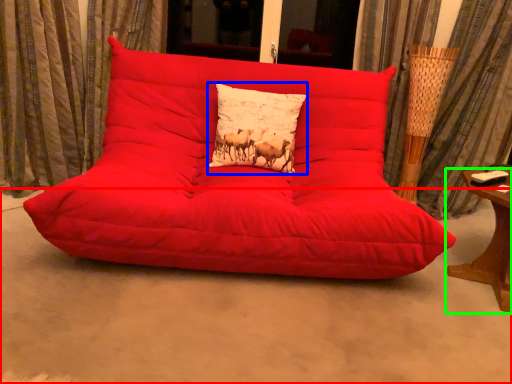
Question: Which is farther away from concrete (highlighted by a red box)? pillow (highlighted by a blue box) or table (highlighted by a green box)?

Choices:
 (A) pillow
 (B) table

Answer: (A)